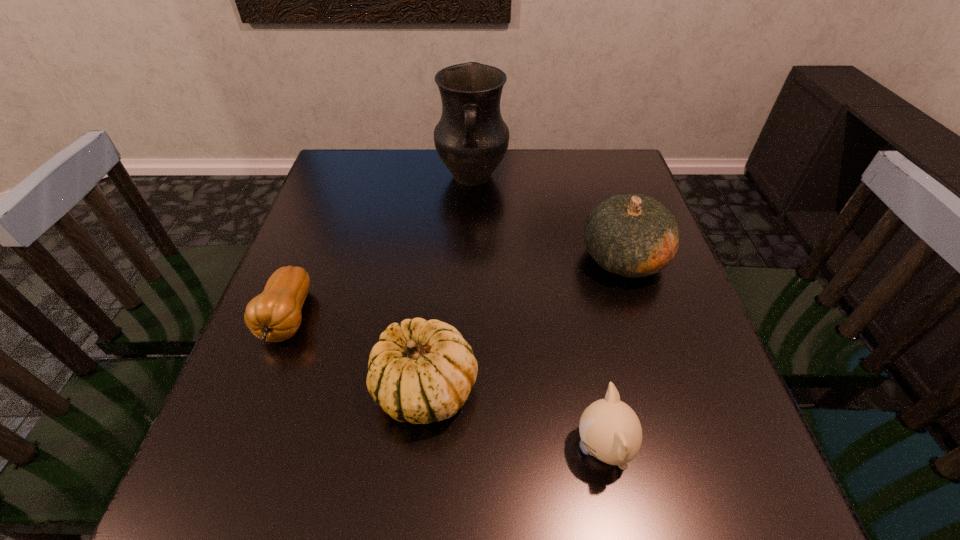
Locate an element on the screen. The height and width of the screenshot is (540, 960). vacant space located on the face of the kitten is located at coordinates (493, 448).

Identify the location of free location located on the face of the kitten. (493, 448).

This screenshot has width=960, height=540. Identify the location of vacant point located 0.250m on the face of the kitten. (420, 448).

This screenshot has width=960, height=540. Identify the location of free region located on the stem side of the shortest object. (228, 476).

Locate an element on the screen. This screenshot has width=960, height=540. object located in the far edge section of the desktop is located at coordinates (471, 138).

I want to click on object present at the near edge, so click(610, 430).

You are a GUI agent. You are given a task and a screenshot of the screen. Output one action in this format:
    pyautogui.click(x=<x>, y=<y>)
    Task: Click on the object that is at the left edge
    The image size is (960, 540).
    Given the screenshot: What is the action you would take?
    pyautogui.click(x=274, y=315)

At what (x,y) coordinates should I click in order to perform the action: click on object at the right edge. Please return your answer as a coordinate pair (x, y). Looking at the image, I should click on (633, 235).

I want to click on blank space at the far edge of the desktop, so click(402, 153).

Find the location of `vacant area at the near edge`. vacant area at the near edge is located at coordinates (589, 500).